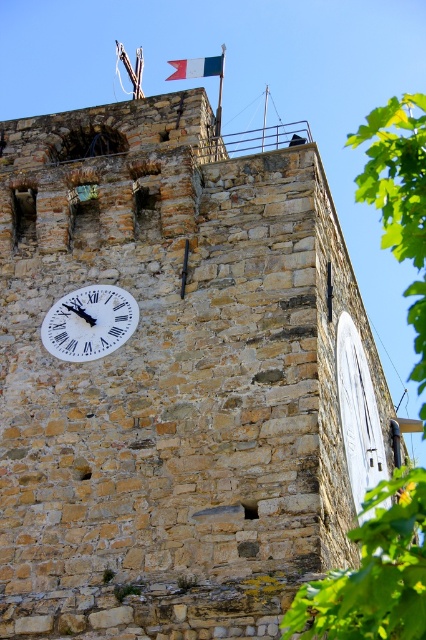
You are standing in front of the historic stone tower and want to know which object has a greater width between the green leafy tree at right and the white fabric flag at top center. Can you tell me which one is wider?

The green leafy tree at right has a greater width than the white fabric flag at top center.